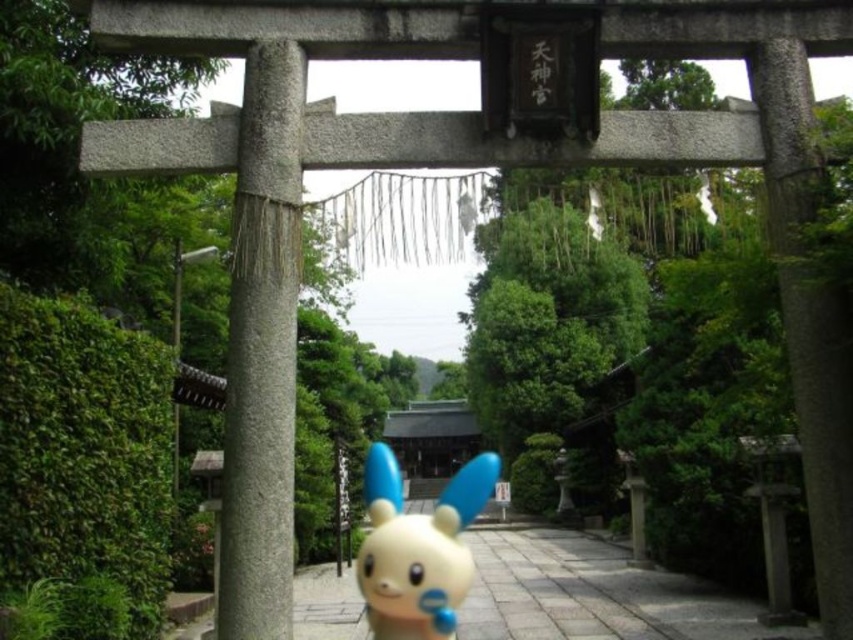
Question: Does gray stone pillar at left come behind white matte toy at center?

Choices:
 (A) no
 (B) yes

Answer: (A)

Question: Which of the following is the closest to the observer?

Choices:
 (A) gray stone pillar at left
 (B) white matte toy at center

Answer: (A)

Question: Among these points, which one is farthest from the camera?

Choices:
 (A) (252, 422)
 (B) (614, 577)

Answer: (B)

Question: Which point is closer to the camera taking this photo?

Choices:
 (A) click(x=548, y=609)
 (B) click(x=387, y=560)
 (C) click(x=268, y=292)

Answer: (B)

Question: Considering the relative positions of gray stone pillar at left and yellow matte toy at center in the image provided, where is gray stone pillar at left located with respect to yellow matte toy at center?

Choices:
 (A) above
 (B) below

Answer: (A)

Question: Does gray stone pillar at left have a larger size compared to white matte toy at center?

Choices:
 (A) yes
 (B) no

Answer: (B)